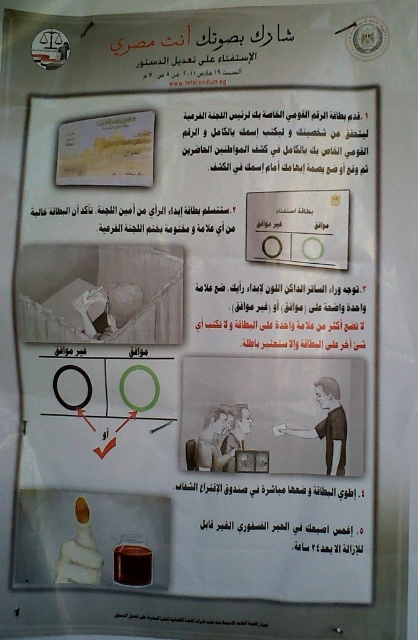
You are looking at an instructional poster about voting in Egypt. There is a black paper at center and a white paper at upper center. Which paper is closer to you?

The black paper at center is closer to you because it is in front of the white paper at upper center.